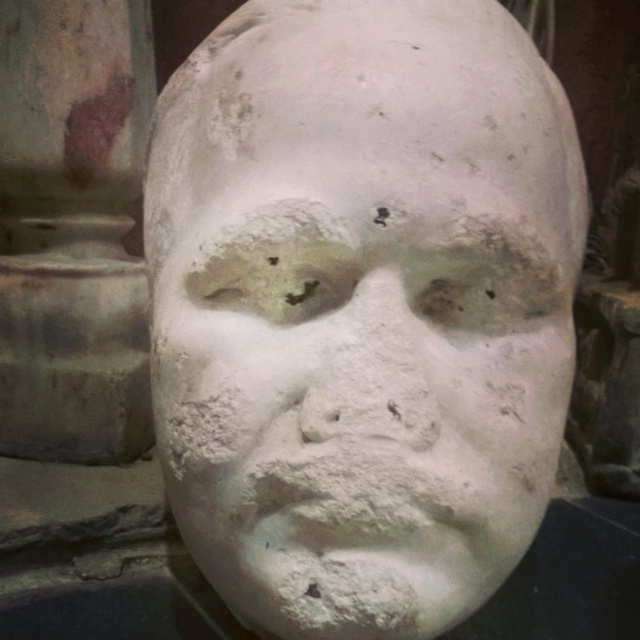
Which of these two, white plaster mask at center or white matte plaster at center, stands shorter?

Standing shorter between the two is white matte plaster at center.

Which is more to the left, white plaster mask at center or white matte plaster at center?

white plaster mask at center

Is point (298, 67) positioned in front of point (173, 164)?

Yes, point (298, 67) is in front of point (173, 164).

Where is `white plaster mask at center`? This screenshot has width=640, height=640. white plaster mask at center is located at coordinates (362, 307).